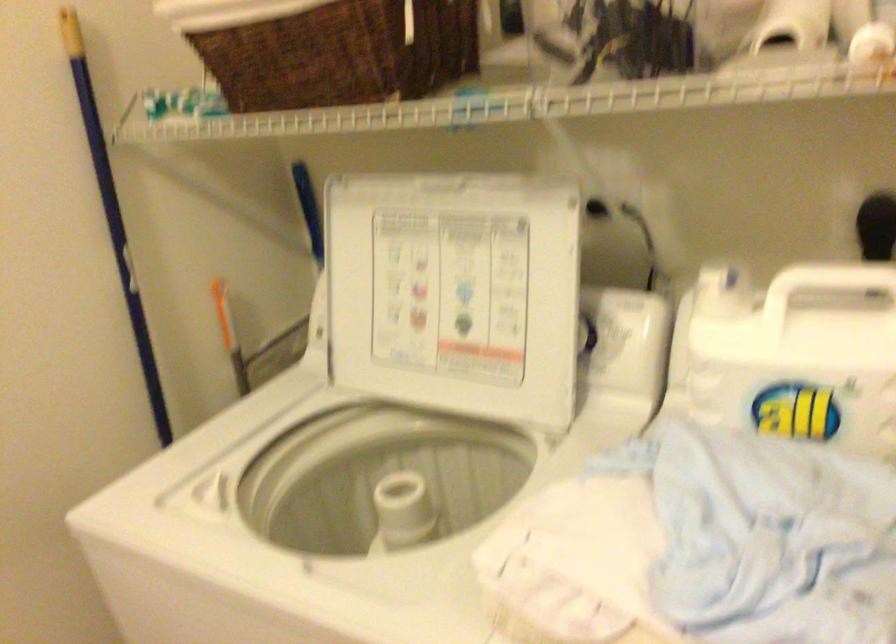
The width and height of the screenshot is (896, 644). What do you see at coordinates (454, 292) in the screenshot? I see `the white washing machine lid` at bounding box center [454, 292].